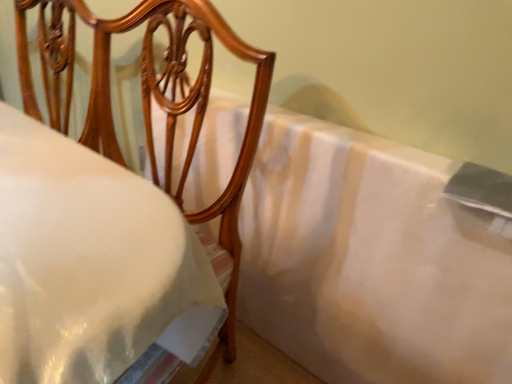
What do you see at coordinates (371, 260) in the screenshot? Image resolution: width=512 pixels, height=384 pixels. I see `white satin bedsheet at center` at bounding box center [371, 260].

This screenshot has width=512, height=384. I want to click on white satin bedsheet at center, so click(371, 260).

The image size is (512, 384). What do you see at coordinates (150, 107) in the screenshot?
I see `matte wood chair at upper left` at bounding box center [150, 107].

The image size is (512, 384). Find the location of `matte wood chair at upper left`. matte wood chair at upper left is located at coordinates (150, 107).

At what (x,y) coordinates should I click in order to perform the action: click on white satin bedsheet at center. Please return your answer as a coordinate pair (x, y). This screenshot has height=384, width=512. Looking at the image, I should click on (371, 260).

Does white satin bedsheet at center appear on the left side of matte wood chair at upper left?

In fact, white satin bedsheet at center is to the right of matte wood chair at upper left.

Who is more distant, white satin bedsheet at center or matte wood chair at upper left?

white satin bedsheet at center is behind.

Is point (361, 230) in front of point (265, 100)?

No.

From the image's perspective, would you say white satin bedsheet at center is positioned over matte wood chair at upper left?

No, from the image's perspective, white satin bedsheet at center is not above matte wood chair at upper left.

From a real-world perspective, which object stands above the other?

matte wood chair at upper left is physically above.

Considering the relative sizes of white satin bedsheet at center and matte wood chair at upper left in the image provided, is white satin bedsheet at center thinner than matte wood chair at upper left?

Yes.

Does white satin bedsheet at center have a greater height compared to matte wood chair at upper left?

No.

Considering the sizes of white satin bedsheet at center and matte wood chair at upper left in the image, is white satin bedsheet at center bigger or smaller than matte wood chair at upper left?

Considering their sizes, white satin bedsheet at center takes up less space than matte wood chair at upper left.

Would you say white satin bedsheet at center is outside matte wood chair at upper left?

Yes, white satin bedsheet at center is outside of matte wood chair at upper left.

Would you say white satin bedsheet at center is a long distance from matte wood chair at upper left?

No.

Is white satin bedsheet at center facing towards matte wood chair at upper left?

Yes, white satin bedsheet at center faces towards matte wood chair at upper left.

Consider the image. How different are the orientations of white satin bedsheet at center and matte wood chair at upper left in degrees?

The facing directions of white satin bedsheet at center and matte wood chair at upper left are 7.76 degrees apart.

The height and width of the screenshot is (384, 512). In order to click on sheet below the matte wood chair at upper left (from a real-world perspective) in this screenshot , I will do `click(371, 260)`.

Between matte wood chair at upper left and white satin bedsheet at center, which one appears on the left side from the viewer's perspective?

matte wood chair at upper left is more to the left.

Relative to white satin bedsheet at center, is matte wood chair at upper left in front or behind?

Visually, matte wood chair at upper left is located in front of white satin bedsheet at center.

Is point (144, 9) closer to viewer compared to point (396, 218)?

Yes, it is in front of point (396, 218).

From the image's perspective, who appears lower, matte wood chair at upper left or white satin bedsheet at center?

From the image's view, white satin bedsheet at center is below.

From a real-world perspective, is matte wood chair at upper left above or below white satin bedsheet at center?

matte wood chair at upper left is situated higher than white satin bedsheet at center in the real world.

Which of these two, matte wood chair at upper left or white satin bedsheet at center, is thinner?

With smaller width is white satin bedsheet at center.

Considering the sizes of objects matte wood chair at upper left and white satin bedsheet at center in the image provided, who is taller, matte wood chair at upper left or white satin bedsheet at center?

With more height is matte wood chair at upper left.

Is matte wood chair at upper left smaller than white satin bedsheet at center?

No.

Can white satin bedsheet at center be found inside matte wood chair at upper left?

No, white satin bedsheet at center is not surrounded by matte wood chair at upper left.

In the scene shown: Is matte wood chair at upper left next to white satin bedsheet at center?

No, matte wood chair at upper left is not beside white satin bedsheet at center.

Is matte wood chair at upper left oriented towards white satin bedsheet at center?

No, matte wood chair at upper left is not oriented towards white satin bedsheet at center.

Identify the location of furniture in front of the white satin bedsheet at center. coord(150,107).

This screenshot has width=512, height=384. I want to click on sheet behind the matte wood chair at upper left, so click(371, 260).

The image size is (512, 384). Find the location of `furniture above the white satin bedsheet at center (from the image's perspective)`. furniture above the white satin bedsheet at center (from the image's perspective) is located at coordinates (150, 107).